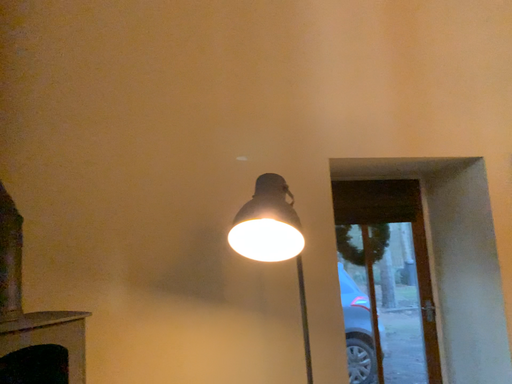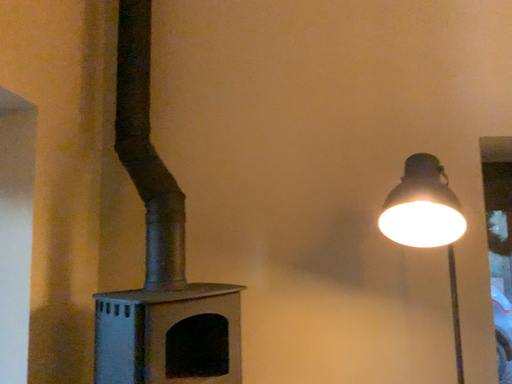
Question: How did the camera likely rotate when shooting the video?

Choices:
 (A) rotated right
 (B) rotated left

Answer: (B)